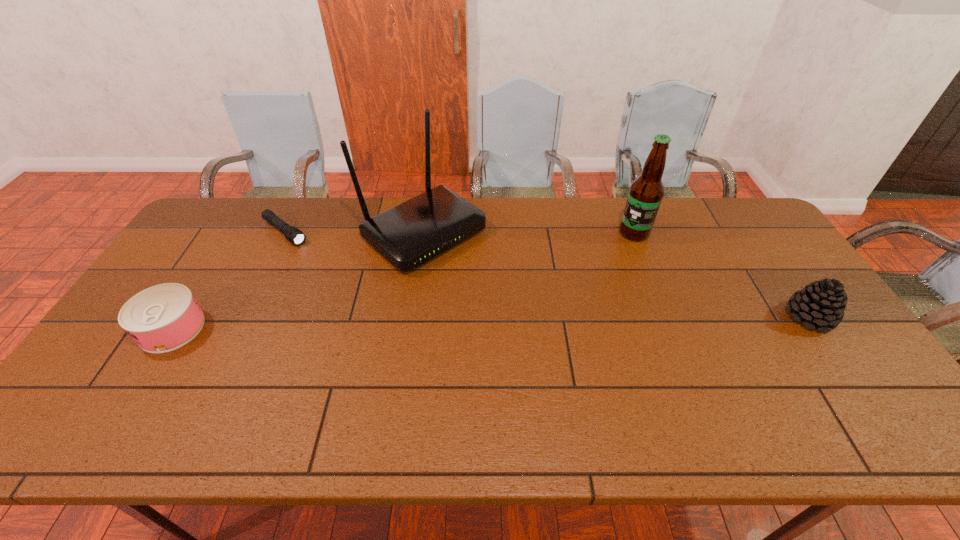
Find the location of a particular element. This screenshot has height=540, width=960. flashlight located at the far edge is located at coordinates (292, 234).

Find the location of a particular element. This screenshot has height=540, width=960. object present at the left edge is located at coordinates (164, 317).

Find the location of a particular element. The image size is (960, 540). object that is at the right edge is located at coordinates (821, 304).

In the image, there is a desktop. What are the coordinates of `free space at the far edge` in the screenshot? It's located at (335, 215).

Where is `free spot at the near edge of the desktop`? free spot at the near edge of the desktop is located at coordinates (341, 377).

Where is `free location at the left edge`? Image resolution: width=960 pixels, height=540 pixels. free location at the left edge is located at coordinates (187, 243).

This screenshot has width=960, height=540. I want to click on vacant area at the right edge, so click(781, 282).

In the image, there is a desktop. What are the coordinates of `vacant space at the far left corner` in the screenshot? It's located at (230, 199).

I want to click on vacant space at the near left corner of the desktop, so click(79, 397).

The height and width of the screenshot is (540, 960). Find the location of `vacant space at the near right corner of the desktop`. vacant space at the near right corner of the desktop is located at coordinates (851, 392).